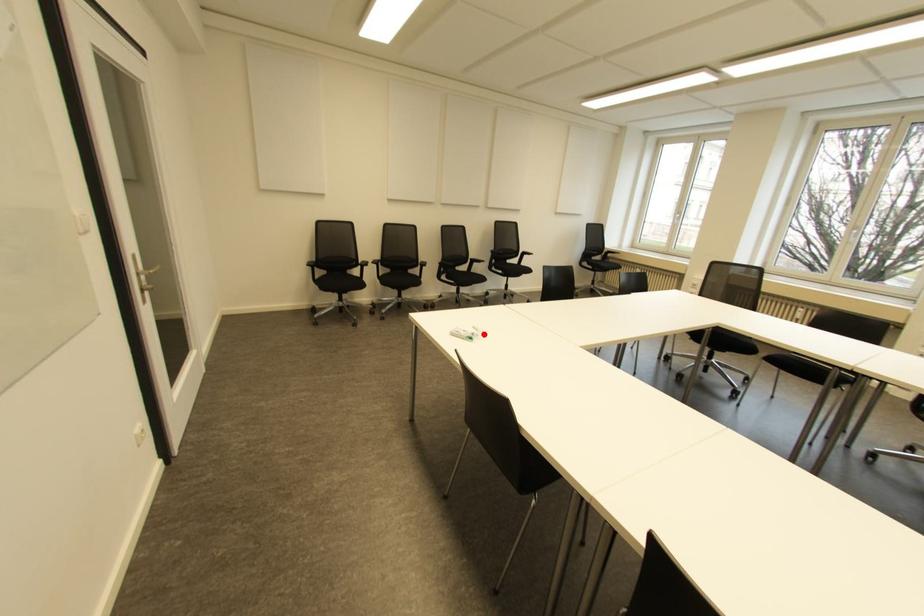
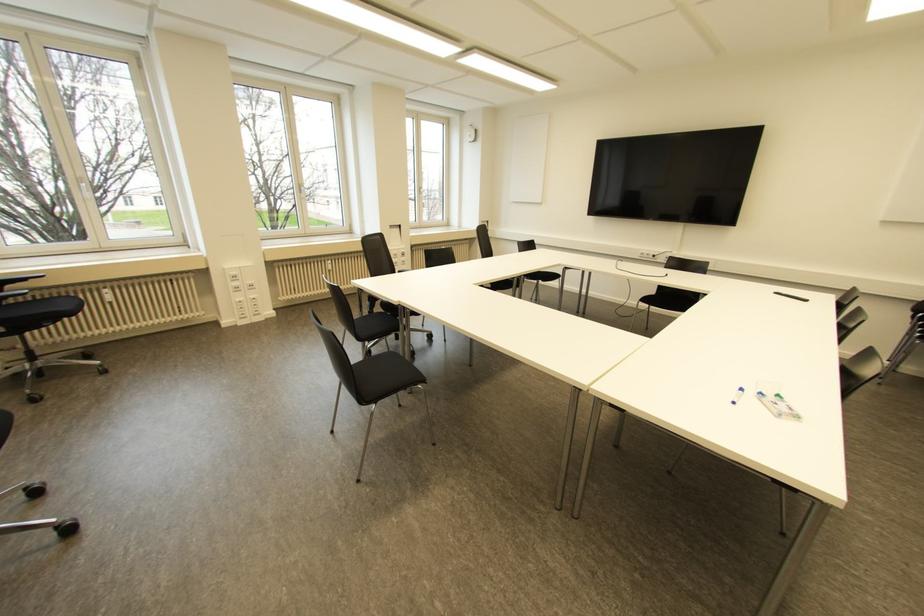
Question: I am providing you with two images of the same scene from different viewpoints. A red point is shown in image1. For the corresponding object point in image2, is it positioned nearer or farther from the camera?

Choices:
 (A) Nearer
 (B) Farther

Answer: (A)